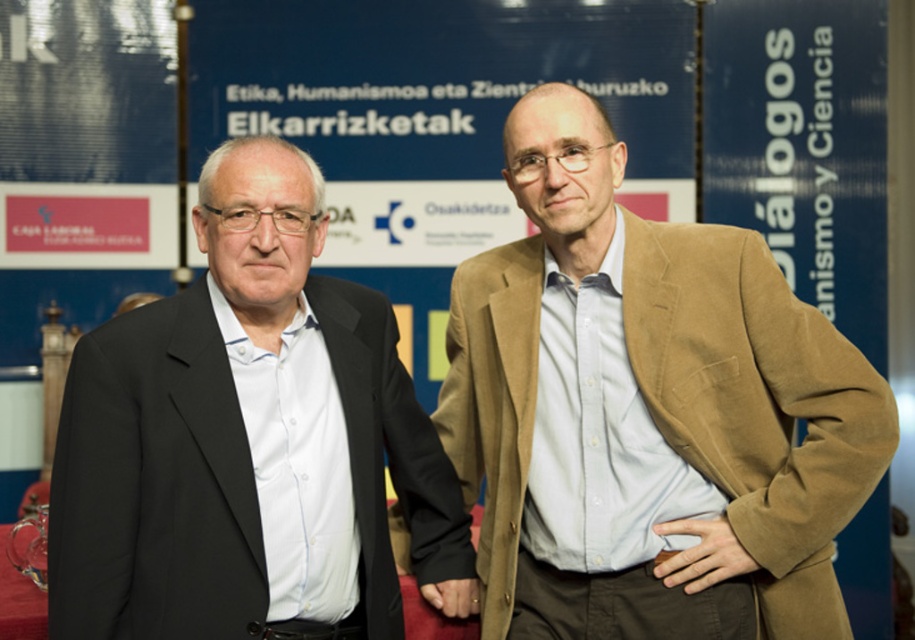
Question: Is matte black suit at left wider than smooth skin hand at center?

Choices:
 (A) no
 (B) yes

Answer: (B)

Question: Which point is farther to the camera?

Choices:
 (A) pos(238,202)
 (B) pos(459,476)
 (C) pos(712,525)
 (D) pos(438,600)

Answer: (B)

Question: Considering the relative positions of light brown suede blazer at center and matte black suit at left in the image provided, where is light brown suede blazer at center located with respect to matte black suit at left?

Choices:
 (A) right
 (B) left

Answer: (A)

Question: Observing the image, what is the correct spatial positioning of matte black suit at left in reference to smooth skin hand at center?

Choices:
 (A) above
 (B) below

Answer: (A)

Question: Which point is closer to the camera?

Choices:
 (A) light brown suede blazer at center
 (B) matte black suit at left
 (C) light brown leather hand at center

Answer: (B)

Question: Which point is closer to the camera?

Choices:
 (A) light brown leather hand at center
 (B) smooth skin hand at center
 (C) light brown suede blazer at center
 (D) matte black suit at left

Answer: (D)